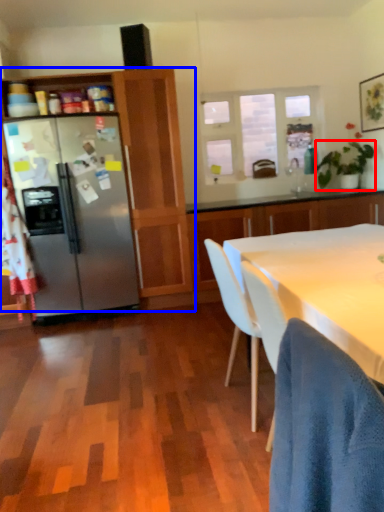
Question: Which point is further to the camera, houseplant (highlighted by a red box) or cabinetry (highlighted by a blue box)?

Choices:
 (A) houseplant
 (B) cabinetry

Answer: (A)